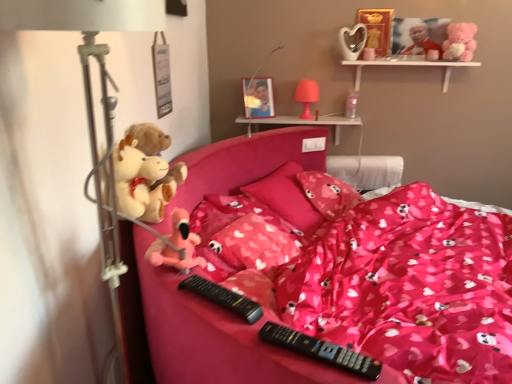
This screenshot has height=384, width=512. In order to click on free location to the left of transparent plastic cup at upper center, acting as the third toy starting from the bottom in this screenshot , I will do `click(332, 118)`.